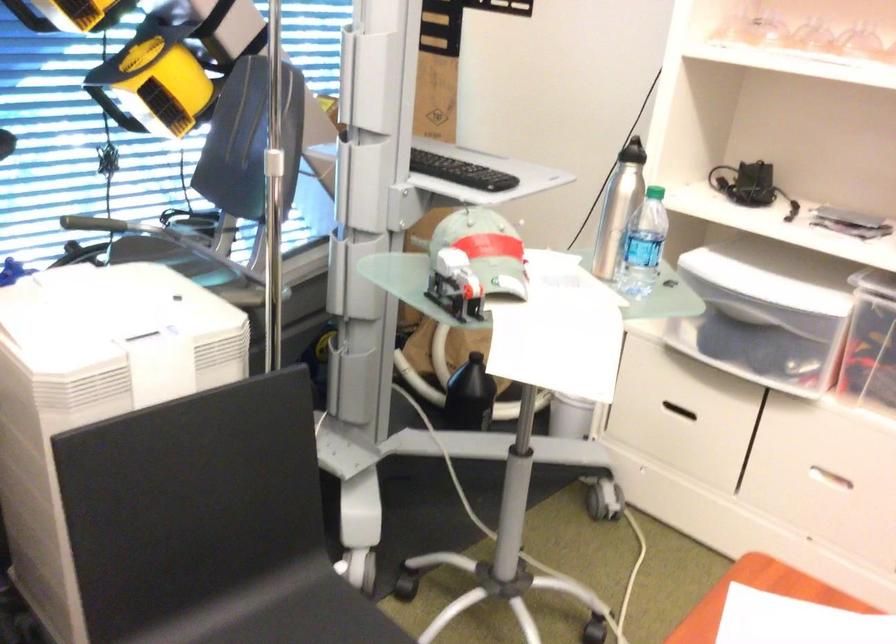
This screenshot has width=896, height=644. Identify the location of silver water bottle. (643, 245).